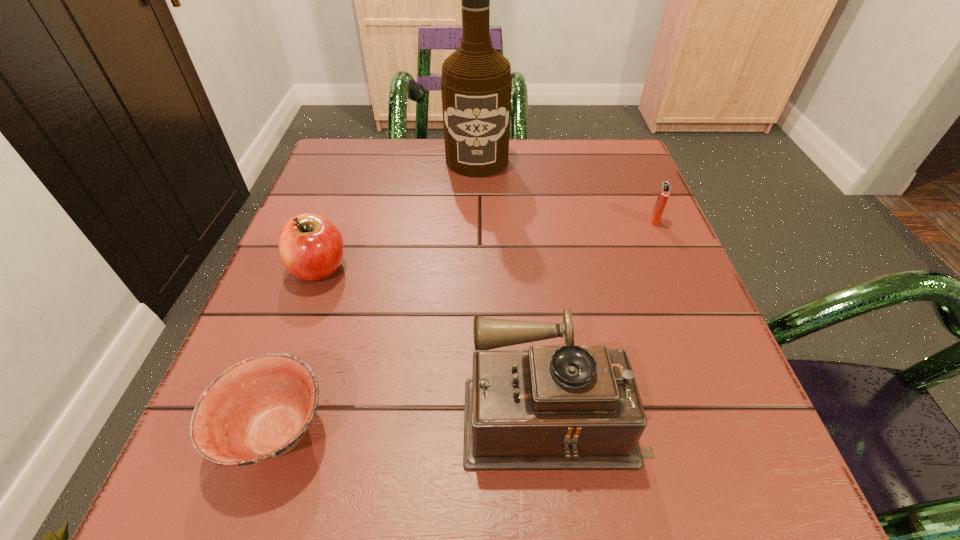
Where is `the farthest object`? Image resolution: width=960 pixels, height=540 pixels. the farthest object is located at coordinates (476, 84).

Image resolution: width=960 pixels, height=540 pixels. I want to click on alcohol, so pos(476,84).

Locate an element on the screen. The width and height of the screenshot is (960, 540). phonograph_record is located at coordinates (553, 407).

I want to click on the third tallest object, so click(x=311, y=247).

Where is `apple`? Image resolution: width=960 pixels, height=540 pixels. apple is located at coordinates (311, 247).

Where is `igniter`? The height and width of the screenshot is (540, 960). igniter is located at coordinates (664, 192).

Where is `the fourth nearest object`? Image resolution: width=960 pixels, height=540 pixels. the fourth nearest object is located at coordinates (664, 192).

This screenshot has height=540, width=960. In order to click on bowl in this screenshot , I will do `click(257, 410)`.

Where is `vacant region located on the label of the alcohol`? The width and height of the screenshot is (960, 540). vacant region located on the label of the alcohol is located at coordinates pyautogui.click(x=476, y=275).

The width and height of the screenshot is (960, 540). I want to click on vacant space located on the horn of the phonograph_record, so click(x=332, y=406).